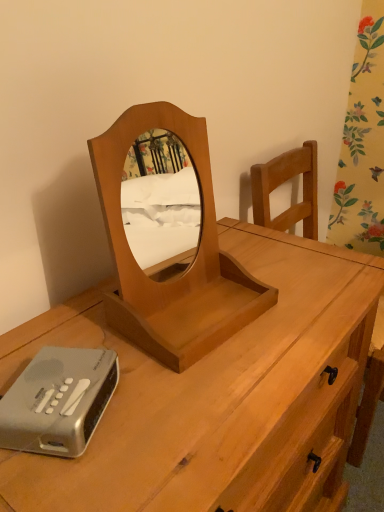
Question: Considering the positions of light brown wood mirror at center and silver plastic alarm clock at lower left in the image, is light brown wood mirror at center wider or thinner than silver plastic alarm clock at lower left?

Choices:
 (A) thin
 (B) wide

Answer: (B)

Question: From the image's perspective, is light brown wood mirror at center located above or below silver plastic alarm clock at lower left?

Choices:
 (A) below
 (B) above

Answer: (B)

Question: Estimate the real-world distances between objects in this image. Which object is farther from the light brown wood desk at center?

Choices:
 (A) light brown wood mirror at center
 (B) silver plastic alarm clock at lower left

Answer: (B)

Question: Which of these objects is positioned closest to the light brown wood mirror at center?

Choices:
 (A) light brown wood desk at center
 (B) silver plastic alarm clock at lower left

Answer: (A)